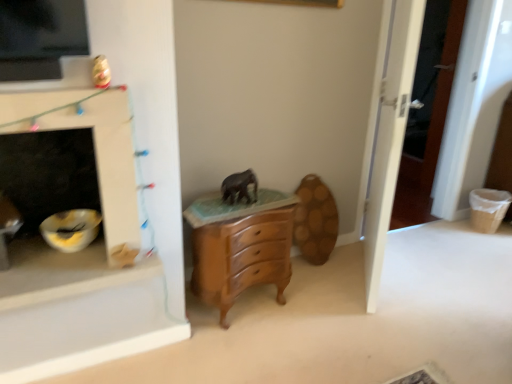
Question: From a real-world perspective, is matte gray elephant at center physically located above or below wooden chest of drawers at center?

Choices:
 (A) above
 (B) below

Answer: (A)

Question: Is point (x=244, y=183) closer or farther from the camera than point (x=279, y=296)?

Choices:
 (A) farther
 (B) closer

Answer: (B)

Question: Which object is the farthest from the matte gray elephant at center?

Choices:
 (A) wooden chest of drawers at center
 (B) white glossy fireplace at left
 (C) white wooden door at right

Answer: (C)

Question: Which object is positioned closest to the white glossy fireplace at left?

Choices:
 (A) matte gray elephant at center
 (B) white wooden door at right
 (C) wooden chest of drawers at center

Answer: (C)